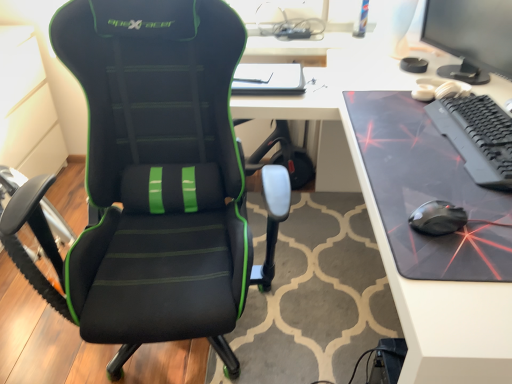
You are a GUI agent. You are given a task and a screenshot of the screen. Output one action in this format:
    pyautogui.click(x=<x>, y=<y>)
    Task: Click on the free location in front of black glossy mouse at right
    Image resolution: width=512 pixels, height=384 pixels.
    Given the screenshot: What is the action you would take?
    pyautogui.click(x=454, y=272)